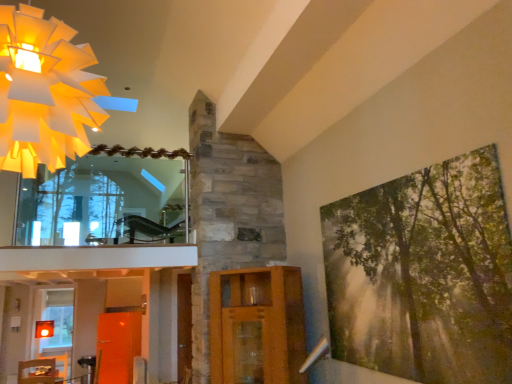
Question: Are green textured canvas at right and translucent glass window at lower left located far from each other?

Choices:
 (A) no
 (B) yes

Answer: (B)

Question: Considering the relative sizes of green textured canvas at right and translucent glass window at lower left in the image provided, is green textured canvas at right taller than translucent glass window at lower left?

Choices:
 (A) no
 (B) yes

Answer: (A)

Question: Is green textured canvas at right facing away from translucent glass window at lower left?

Choices:
 (A) yes
 (B) no

Answer: (B)

Question: Considering the relative sizes of green textured canvas at right and translucent glass window at lower left in the image provided, is green textured canvas at right bigger than translucent glass window at lower left?

Choices:
 (A) no
 (B) yes

Answer: (A)

Question: Is green textured canvas at right positioned behind translucent glass window at lower left?

Choices:
 (A) no
 (B) yes

Answer: (A)

Question: Considering the positions of green textured canvas at right and matte paper chandelier at upper left in the image, is green textured canvas at right bigger or smaller than matte paper chandelier at upper left?

Choices:
 (A) big
 (B) small

Answer: (B)

Question: Based on their positions, is green textured canvas at right located to the left or right of matte paper chandelier at upper left?

Choices:
 (A) left
 (B) right

Answer: (B)

Question: Would you say green textured canvas at right is inside or outside matte paper chandelier at upper left?

Choices:
 (A) outside
 (B) inside

Answer: (A)

Question: Is green textured canvas at right wider or thinner than matte paper chandelier at upper left?

Choices:
 (A) thin
 (B) wide

Answer: (A)

Question: From the image's perspective, is matte paper chandelier at upper left located above or below translucent glass window at lower left?

Choices:
 (A) above
 (B) below

Answer: (A)

Question: Is matte paper chandelier at upper left taller or shorter than translucent glass window at lower left?

Choices:
 (A) short
 (B) tall

Answer: (A)

Question: Would you say matte paper chandelier at upper left is inside or outside translucent glass window at lower left?

Choices:
 (A) outside
 (B) inside

Answer: (A)

Question: Considering the relative positions of matte paper chandelier at upper left and translucent glass window at lower left in the image provided, is matte paper chandelier at upper left to the left or to the right of translucent glass window at lower left?

Choices:
 (A) left
 (B) right

Answer: (B)

Question: Relative to translucent glass window at lower left, is clear glass mirror at upper left in front or behind?

Choices:
 (A) behind
 (B) front

Answer: (B)

Question: From a real-world perspective, is clear glass mirror at upper left positioned above or below translucent glass window at lower left?

Choices:
 (A) above
 (B) below

Answer: (A)